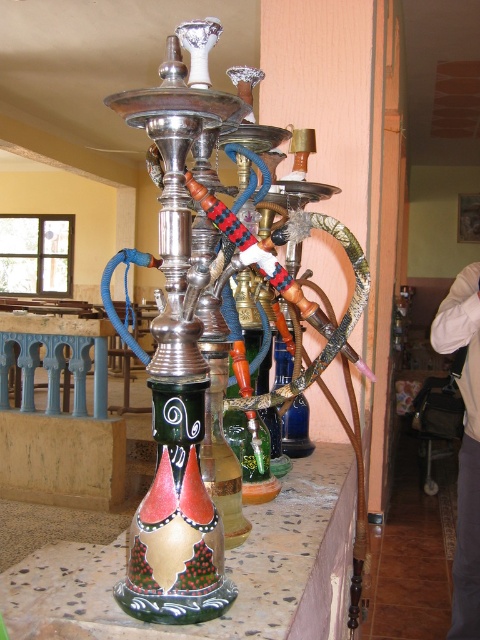
Question: Is painted ceramic hookah at center above white fabric shirt at upper right?

Choices:
 (A) yes
 (B) no

Answer: (A)

Question: Is painted ceramic vase at center positioned before blue painted wood table at lower left?

Choices:
 (A) no
 (B) yes

Answer: (B)

Question: Among these objects, which one is nearest to the camera?

Choices:
 (A) painted ceramic hookah at center
 (B) blue painted wood table at lower left
 (C) white fabric shirt at upper right

Answer: (A)

Question: Among these points, which one is nearest to the camera?

Choices:
 (A) (214, 532)
 (B) (52, 390)
 (C) (276, 522)

Answer: (A)

Question: Which object appears closest to the camera in this image?

Choices:
 (A) blue painted wood table at lower left
 (B) white fabric shirt at upper right
 (C) painted ceramic vase at center

Answer: (C)

Question: Can you confirm if painted ceramic hookah at center is positioned to the left of white fabric shirt at upper right?

Choices:
 (A) no
 (B) yes

Answer: (B)